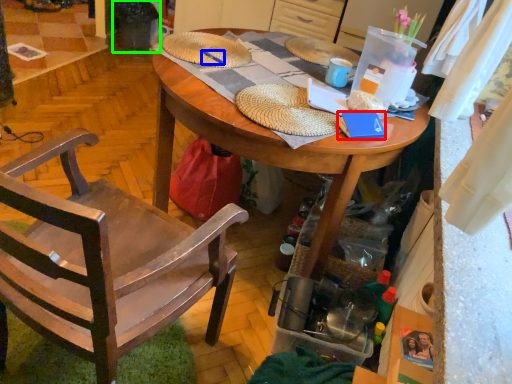
Question: Which is farther away from book (highlighted by a red box)? pen (highlighted by a blue box) or trash bin/can (highlighted by a green box)?

Choices:
 (A) pen
 (B) trash bin/can

Answer: (B)